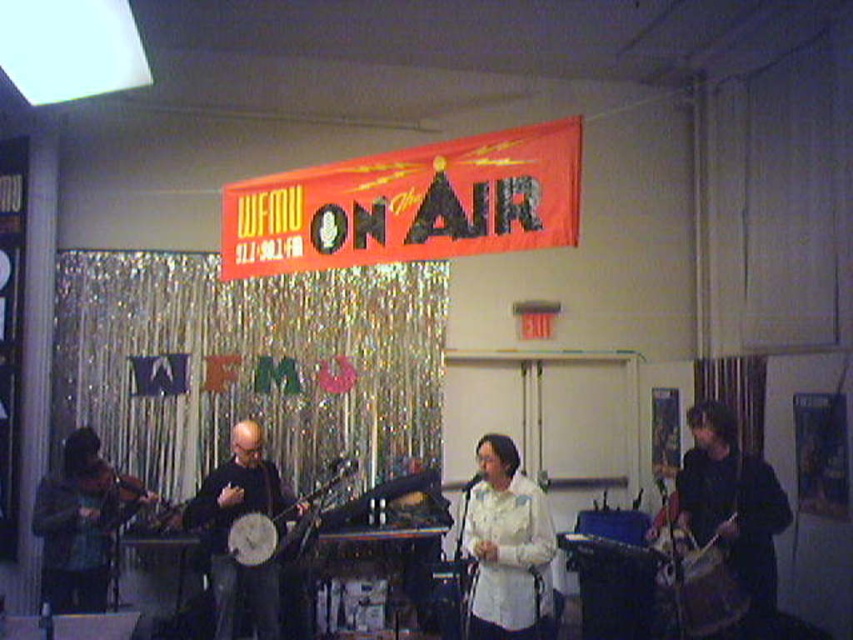
Is dark brown leather drum at right to the right of wooden drum at right from the viewer's perspective?

Indeed, dark brown leather drum at right is positioned on the right side of wooden drum at right.

The height and width of the screenshot is (640, 853). Identify the location of dark brown leather drum at right. (733, 508).

Identify the location of dark brown leather drum at right. This screenshot has width=853, height=640. (733, 508).

Who is lower down, white textured shirt at center or wooden banjo at center?

wooden banjo at center is lower down.

What do you see at coordinates (506, 545) in the screenshot? I see `white textured shirt at center` at bounding box center [506, 545].

Find the location of `white textured shirt at center`. white textured shirt at center is located at coordinates (506, 545).

Which is more to the right, matte black banjo at center or black matte banjo at center?

matte black banjo at center is more to the right.

Who is more forward, (734, 545) or (212, 572)?

Point (734, 545)

Does point (701, 490) come closer to viewer compared to point (222, 502)?

That is True.

The height and width of the screenshot is (640, 853). Find the location of `matte black banjo at center`. matte black banjo at center is located at coordinates (726, 528).